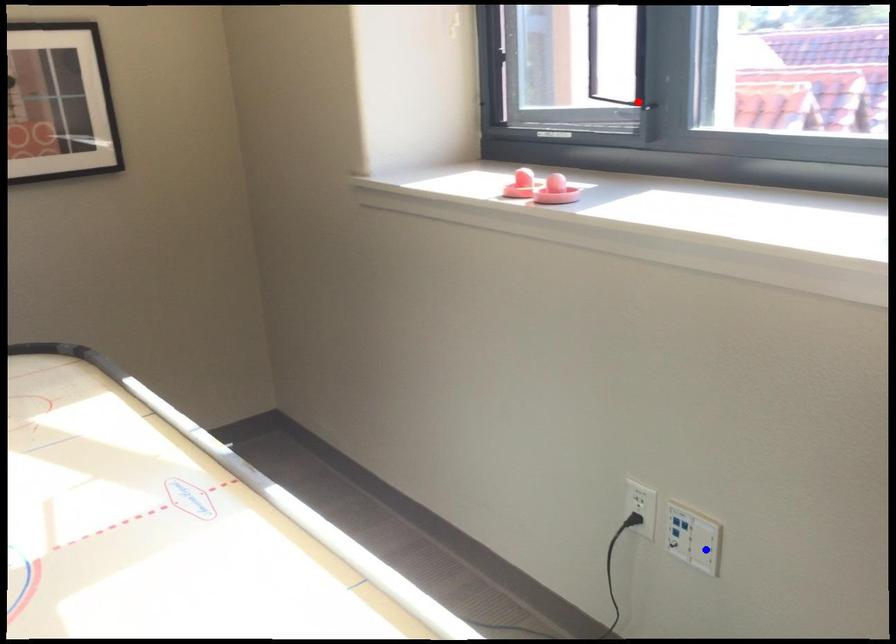
Question: Which of the two points in the image is closer to the camera?

Choices:
 (A) Blue point is closer.
 (B) Red point is closer.

Answer: (A)